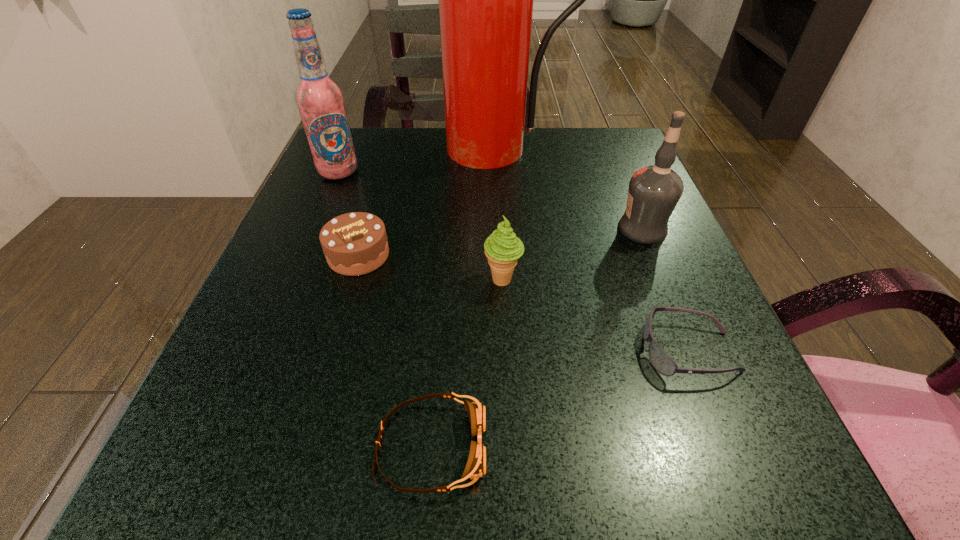
I want to click on object at the near edge, so click(475, 467).

Where is `alcohol present at the left edge`? This screenshot has height=540, width=960. alcohol present at the left edge is located at coordinates (x=320, y=101).

Identify the location of chocolate cake that is at the left edge. (356, 243).

Locate an element on the screen. This screenshot has height=540, width=960. fire extinguisher present at the right edge is located at coordinates (485, 0).

Locate an element on the screen. vodka located in the right edge section of the desktop is located at coordinates (654, 191).

Where is `sunglasses that is at the right edge`? The height and width of the screenshot is (540, 960). sunglasses that is at the right edge is located at coordinates (661, 361).

Locate an element on the screen. The image size is (960, 540). object located at the far left corner is located at coordinates (320, 101).

Find the location of a particular element. Image resolution: width=960 pixels, height=540 pixels. object situated at the far right corner is located at coordinates (485, 0).

Where is `free space at the far edge of the desktop`? This screenshot has height=540, width=960. free space at the far edge of the desktop is located at coordinates (406, 135).

Locate an element on the screen. Image resolution: width=960 pixels, height=540 pixels. vacant area at the left edge is located at coordinates (310, 198).